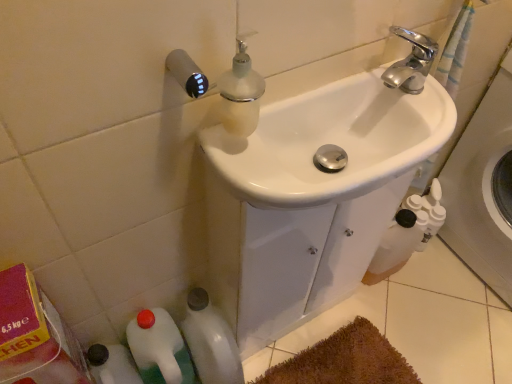
What do you see at coordinates (159, 348) in the screenshot? I see `white plastic bottle at lower left, the second bottle when ordered from right to left` at bounding box center [159, 348].

What do you see at coordinates (210, 341) in the screenshot? Image resolution: width=512 pixels, height=384 pixels. I see `white glossy bottle at lower left, the second bottle when ordered from left to right` at bounding box center [210, 341].

Locate an element on the screen. The image size is (512, 384). white plastic bottle at lower left, which ranks as the 1th bottle in left-to-right order is located at coordinates (159, 348).

How distant is white glossy bottle at lower left, the second bottle when ordered from left to right, from white plastic bottle at lower left, the second bottle when ordered from right to left?

white glossy bottle at lower left, the second bottle when ordered from left to right, is 3.26 inches from white plastic bottle at lower left, the second bottle when ordered from right to left.

From a real-world perspective, relative to white plastic bottle at lower left, the second bottle when ordered from right to left, is white glossy bottle at lower left, the first bottle when ordered from right to left, vertically above or below?

white glossy bottle at lower left, the first bottle when ordered from right to left, is below white plastic bottle at lower left, the second bottle when ordered from right to left.

Is white plastic bottle at lower left, the second bottle when ordered from right to left, surrounded by white glossy bottle at lower left, the second bottle when ordered from left to right?

No, white glossy bottle at lower left, the second bottle when ordered from left to right, does not contain white plastic bottle at lower left, the second bottle when ordered from right to left.

Is point (210, 365) farther from viewer compared to point (181, 345)?

No, (210, 365) is in front of (181, 345).

From a real-world perspective, is white glossy sink at center physically located above or below white glossy bottle at lower left, the first bottle when ordered from right to left?

From a real-world perspective, white glossy sink at center is physically above white glossy bottle at lower left, the first bottle when ordered from right to left.

From the image's perspective, is white glossy sink at center beneath white glossy bottle at lower left, the first bottle when ordered from right to left?

No, from the image's perspective, white glossy sink at center is not below white glossy bottle at lower left, the first bottle when ordered from right to left.

Which object is thinner, white glossy sink at center or white glossy bottle at lower left, the second bottle when ordered from left to right?

white glossy bottle at lower left, the second bottle when ordered from left to right, is thinner.

Does white glossy sink at center appear on the right side of white glossy bottle at lower left, the second bottle when ordered from left to right?

Yes.

Between white plastic bottle at lower left, which ranks as the 1th bottle in left-to-right order, and white plastic bottles at right, which one has larger size?

Bigger between the two is white plastic bottles at right.

Consider the image. Is white plastic bottles at right completely or partially inside white plastic bottle at lower left, which ranks as the 1th bottle in left-to-right order?

Actually, white plastic bottles at right is outside white plastic bottle at lower left, which ranks as the 1th bottle in left-to-right order.

Based on their positions, is white plastic bottle at lower left, the second bottle when ordered from right to left, located to the left or right of white plastic bottles at right?

From the image, it's evident that white plastic bottle at lower left, the second bottle when ordered from right to left, is to the left of white plastic bottles at right.

Considering the points (204, 367) and (494, 270), which point is in front, point (204, 367) or point (494, 270)?

The point (204, 367) is closer.

From the image's perspective, is white glossy bottle at lower left, the first bottle when ordered from right to left, above white plastic bottles at right?

Incorrect, from the image's perspective, white glossy bottle at lower left, the first bottle when ordered from right to left, is lower than white plastic bottles at right.

This screenshot has height=384, width=512. I want to click on the 2nd bottle directly beneath the white plastic bottles at right (from a real-world perspective), so click(x=210, y=341).

In the image, is white glossy bottle at lower left, the second bottle when ordered from left to right, on the left side or the right side of white plastic bottles at right?

Clearly, white glossy bottle at lower left, the second bottle when ordered from left to right, is on the left of white plastic bottles at right in the image.

From a real-world perspective, which is physically above, white plastic bottle at lower left, which ranks as the 1th bottle in left-to-right order, or white glossy bottle at lower left, the first bottle when ordered from right to left?

In real-world perspective, white plastic bottle at lower left, which ranks as the 1th bottle in left-to-right order, is above.

Is white plastic bottle at lower left, which ranks as the 1th bottle in left-to-right order, wider or thinner than white glossy bottle at lower left, the second bottle when ordered from left to right?

Considering their sizes, white plastic bottle at lower left, which ranks as the 1th bottle in left-to-right order, looks slimmer than white glossy bottle at lower left, the second bottle when ordered from left to right.

From the picture: Is white plastic bottle at lower left, which ranks as the 1th bottle in left-to-right order, aimed at white glossy bottle at lower left, the second bottle when ordered from left to right?

No, white plastic bottle at lower left, which ranks as the 1th bottle in left-to-right order, is not turned towards white glossy bottle at lower left, the second bottle when ordered from left to right.

Is white plastic bottles at right positioned in front of white plastic bottle at lower left, the second bottle when ordered from right to left?

Yes, the depth of white plastic bottles at right is less than that of white plastic bottle at lower left, the second bottle when ordered from right to left.

Which of these two, white plastic bottles at right or white plastic bottle at lower left, which ranks as the 1th bottle in left-to-right order, is smaller?

white plastic bottle at lower left, which ranks as the 1th bottle in left-to-right order, is smaller.

The width and height of the screenshot is (512, 384). I want to click on bath above the white plastic bottle at lower left, the second bottle when ordered from right to left (from the image's perspective), so click(483, 188).

From the image's perspective, between white glossy bottle at lower left, the first bottle when ordered from right to left, and white glossy sink at center, which one is located above?

white glossy sink at center is shown above in the image.

From a real-world perspective, is white glossy bottle at lower left, the first bottle when ordered from right to left, positioned over white glossy sink at center based on gravity?

No.

Is white glossy bottle at lower left, the second bottle when ordered from left to right, further to camera compared to white glossy sink at center?

That is True.

The width and height of the screenshot is (512, 384). Identify the location of the 2nd bottle directly beneath the white glossy sink at center (from a real-world perspective). pos(210,341).

The height and width of the screenshot is (384, 512). What are the coordinates of `bottle that is above the white glossy bottle at lower left, the first bottle when ordered from right to left (from a real-world perspective)` in the screenshot? It's located at (159, 348).

Where is `sink in front of the white glossy bottle at lower left, the first bottle when ordered from right to left`? This screenshot has width=512, height=384. sink in front of the white glossy bottle at lower left, the first bottle when ordered from right to left is located at coordinates (338, 135).

Based on their spatial positions, is white glossy sink at center or white plastic bottle at lower left, the second bottle when ordered from right to left, closer to white glossy bottle at lower left, the first bottle when ordered from right to left?

white plastic bottle at lower left, the second bottle when ordered from right to left.

In the scene shown: Which object lies nearer to the anchor point white plastic bottle at lower left, which ranks as the 1th bottle in left-to-right order, white plastic bottles at right or white glossy sink at center?

white glossy sink at center is closer to white plastic bottle at lower left, which ranks as the 1th bottle in left-to-right order.

When comparing their distances from white glossy sink at center, does white plastic bottles at right or white plastic bottle at lower left, which ranks as the 1th bottle in left-to-right order, seem further?

Based on the image, white plastic bottles at right appears to be further to white glossy sink at center.

When comparing their distances from white glossy sink at center, does white plastic bottle at lower left, the second bottle when ordered from right to left, or white plastic bottles at right seem further?

white plastic bottles at right.

Estimate the real-world distances between objects in this image. Which object is further from white plastic bottles at right, white plastic bottle at lower left, the second bottle when ordered from right to left, or white glossy sink at center?

white plastic bottle at lower left, the second bottle when ordered from right to left, lies further to white plastic bottles at right than the other object.

Considering their positions, is white plastic bottle at lower left, the second bottle when ordered from right to left, positioned closer to white glossy sink at center than white glossy bottle at lower left, the first bottle when ordered from right to left?

white glossy bottle at lower left, the first bottle when ordered from right to left, is positioned closer to the anchor white glossy sink at center.

Considering their positions, is white glossy sink at center positioned further to white plastic bottle at lower left, which ranks as the 1th bottle in left-to-right order, than white glossy bottle at lower left, the first bottle when ordered from right to left?

Based on the image, white glossy sink at center appears to be further to white plastic bottle at lower left, which ranks as the 1th bottle in left-to-right order.

Looking at the image, which one is located closer to white glossy sink at center, white plastic bottles at right or white glossy bottle at lower left, the first bottle when ordered from right to left?

white glossy bottle at lower left, the first bottle when ordered from right to left.

I want to click on bottle that lies between white glossy sink at center and white plastic bottle at lower left, which ranks as the 1th bottle in left-to-right order, from top to bottom, so click(210, 341).

Locate an element on the screen. This screenshot has height=384, width=512. sink between white plastic bottle at lower left, the second bottle when ordered from right to left, and white plastic bottles at right from left to right is located at coordinates (338, 135).

Find the location of a particular element. This screenshot has width=512, height=384. bottle between white plastic bottle at lower left, which ranks as the 1th bottle in left-to-right order, and white plastic bottles at right is located at coordinates (210, 341).

This screenshot has width=512, height=384. In order to click on sink located between white glossy bottle at lower left, the first bottle when ordered from right to left, and white plastic bottles at right in the left-right direction in this screenshot , I will do `click(338, 135)`.